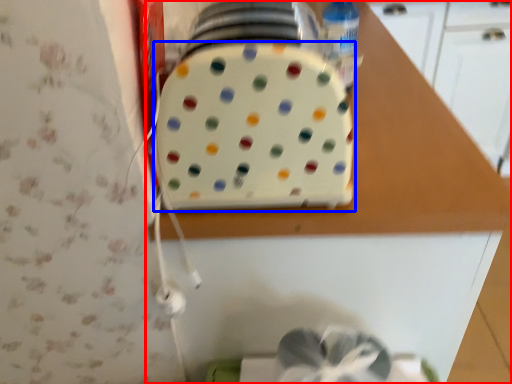
Question: Which object is further to the camera taking this photo, countertop (highlighted by a red box) or toaster (highlighted by a blue box)?

Choices:
 (A) countertop
 (B) toaster

Answer: (A)